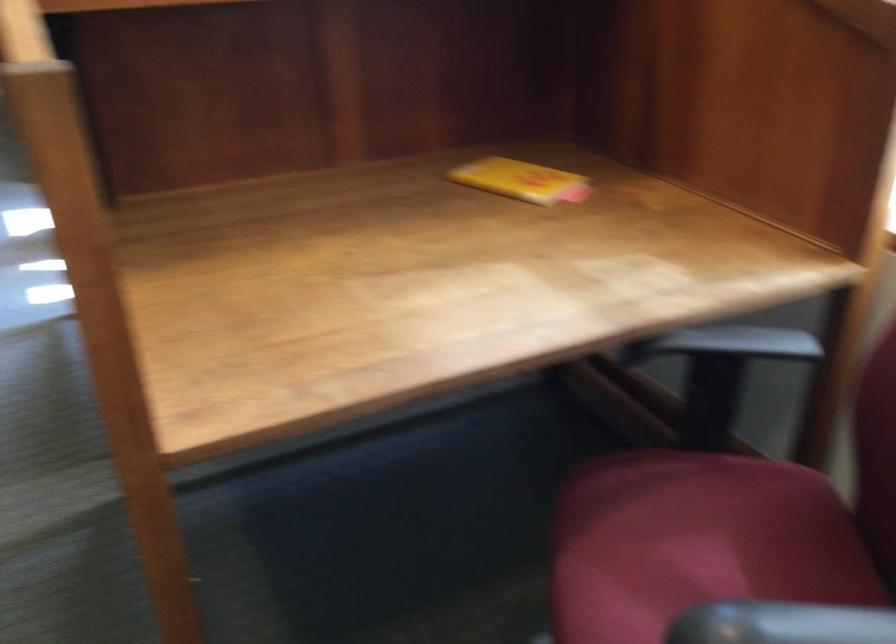
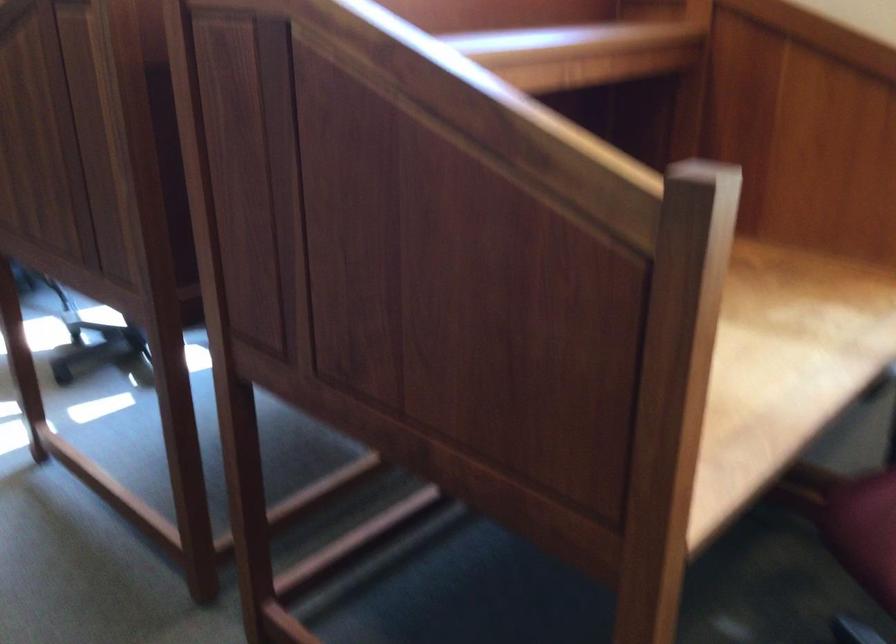
Question: The first image is from the beginning of the video and the second image is from the end. How did the camera likely rotate when shooting the video?

Choices:
 (A) Left
 (B) Right
 (C) Up
 (D) Down

Answer: (B)